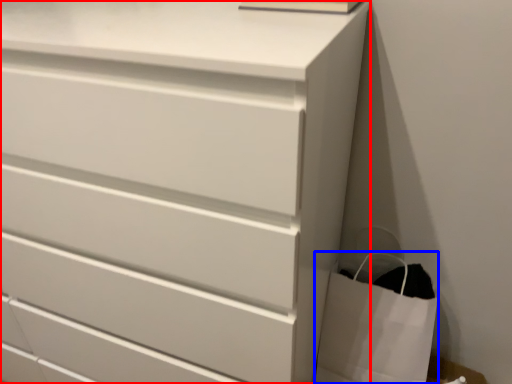
Question: Which of the following is the closest to the observer, chest of drawers (highlighted by a red box) or bag (highlighted by a blue box)?

Choices:
 (A) chest of drawers
 (B) bag

Answer: (A)